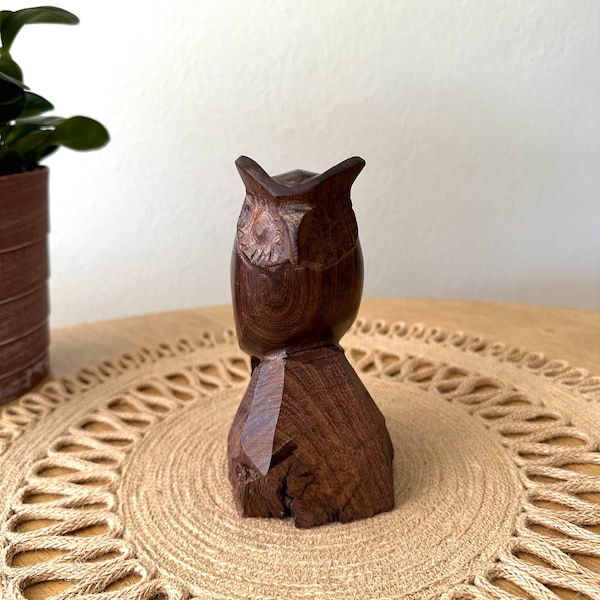
Where is `planter`? planter is located at coordinates (40, 207).